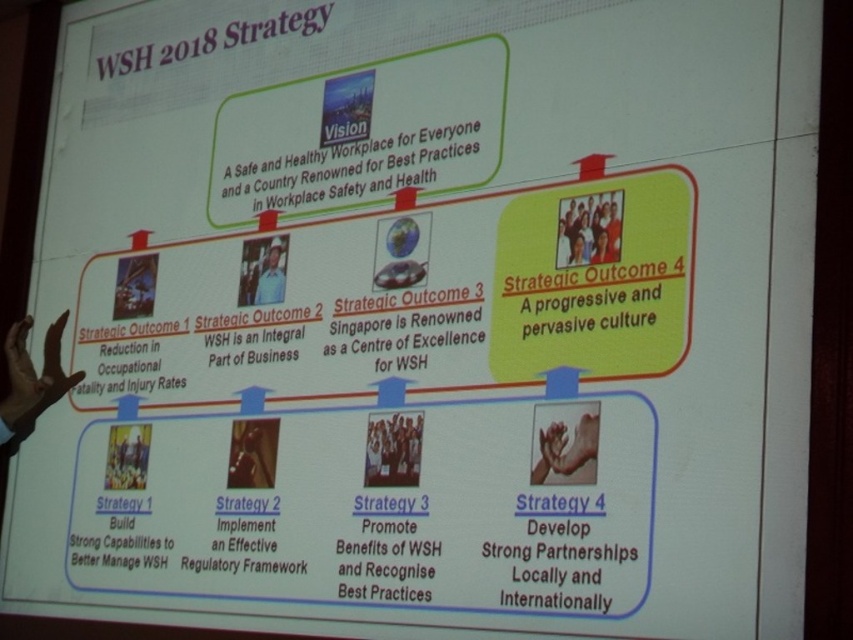
You are standing 5 meters away from the slide. Can you see the point at coordinates [9,400] clearly?

Answer: The point at coordinates [9,400] is 4.38 meters away from the camera. Since you are standing 5 meters away, you are farther than the point, so you might not see it clearly.

Where is the dark skin hand at lower left located on the slide?

The dark skin hand at lower left is located at point (32,380) on the slide.